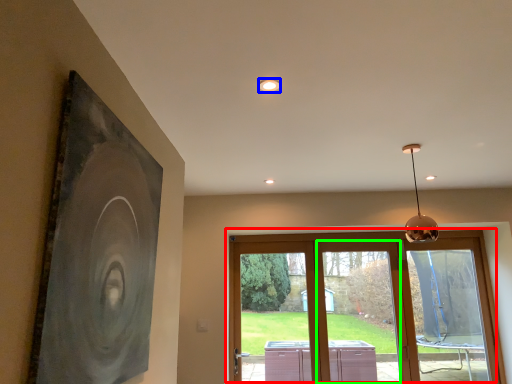
Question: Which is farther away from window (highlighted by a red box)? lighting (highlighted by a blue box) or window (highlighted by a green box)?

Choices:
 (A) lighting
 (B) window

Answer: (A)